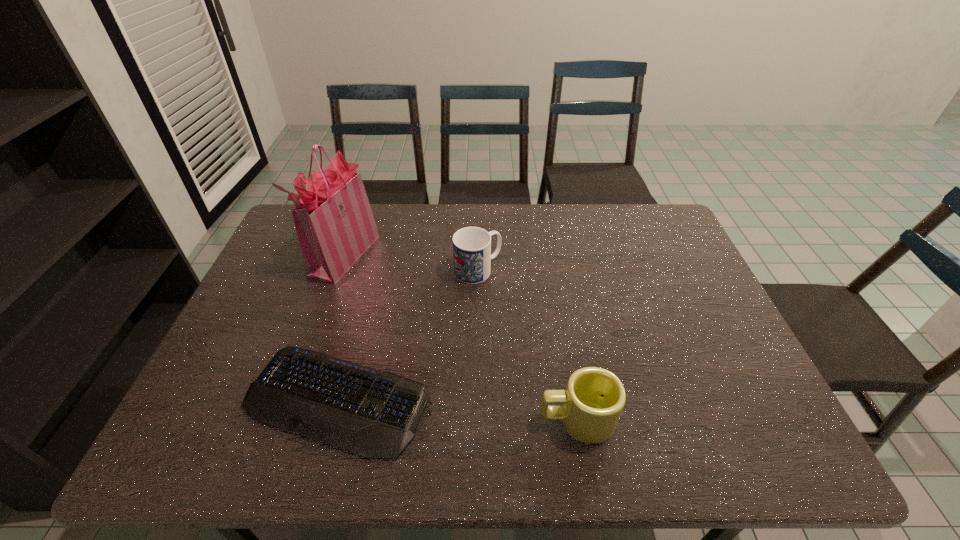
At what (x,y) coordinates should I click in order to perform the action: click on vacant space positioned 0.370m with the handle on the side of the right mug. Please return your answer as a coordinate pair (x, y). The image size is (960, 540). Looking at the image, I should click on (372, 420).

Identify the location of free location located 0.100m on the right of the shortest object. (473, 400).

What are the coordinates of `object present at the far edge` in the screenshot? It's located at (334, 222).

Locate an element on the screen. The width and height of the screenshot is (960, 540). mug located at the near edge is located at coordinates (594, 398).

You are a GUI agent. You are given a task and a screenshot of the screen. Output one action in this format:
    pyautogui.click(x=<x>, y=<y>)
    Task: Click on the computer keyboard situated at the near edge
    
    Given the screenshot: What is the action you would take?
    pyautogui.click(x=371, y=413)

In order to click on shopping bag positioned at the left edge in this screenshot , I will do `click(334, 222)`.

Find the location of a particular element. computer keyboard that is at the left edge is located at coordinates (371, 413).

The image size is (960, 540). In order to click on object present at the far left corner in this screenshot , I will do pyautogui.click(x=334, y=222).

Image resolution: width=960 pixels, height=540 pixels. Identify the location of object at the near left corner. (371, 413).

At what (x,y) coordinates should I click in order to perform the action: click on vacant region at the far edge of the desktop. Please return your answer as a coordinate pair (x, y). Looking at the image, I should click on (438, 214).